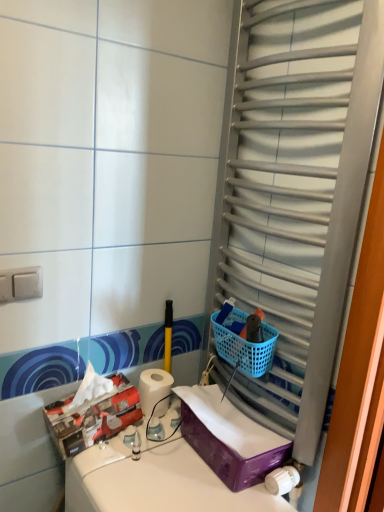
Question: Considering the positions of purple plastic storage box at lower right, arranged as the first storage box when viewed from the right, and blue plastic basket at right in the image, is purple plastic storage box at lower right, arranged as the first storage box when viewed from the right, bigger or smaller than blue plastic basket at right?

Choices:
 (A) small
 (B) big

Answer: (B)

Question: Does point (x=193, y=429) appear closer or farther from the camera than point (x=233, y=339)?

Choices:
 (A) closer
 (B) farther

Answer: (B)

Question: Which is nearer to the white matte toilet paper at center?

Choices:
 (A) blue plastic basket at right
 (B) matte cardboard tissue box at lower left, positioned as the 1th storage box in left-to-right order
 (C) metallic silver towel rack at right
 (D) white plastic switch at upper left
 (E) purple plastic storage box at lower right, placed as the second storage box when sorted from left to right

Answer: (B)

Question: Which object is positioned closest to the blue plastic basket at right?

Choices:
 (A) purple plastic container at lower right
 (B) matte cardboard tissue box at lower left, which ranks as the second storage box in right-to-left order
 (C) white matte toilet paper at center
 (D) white plastic switch at upper left
 (E) metallic silver towel rack at right

Answer: (C)